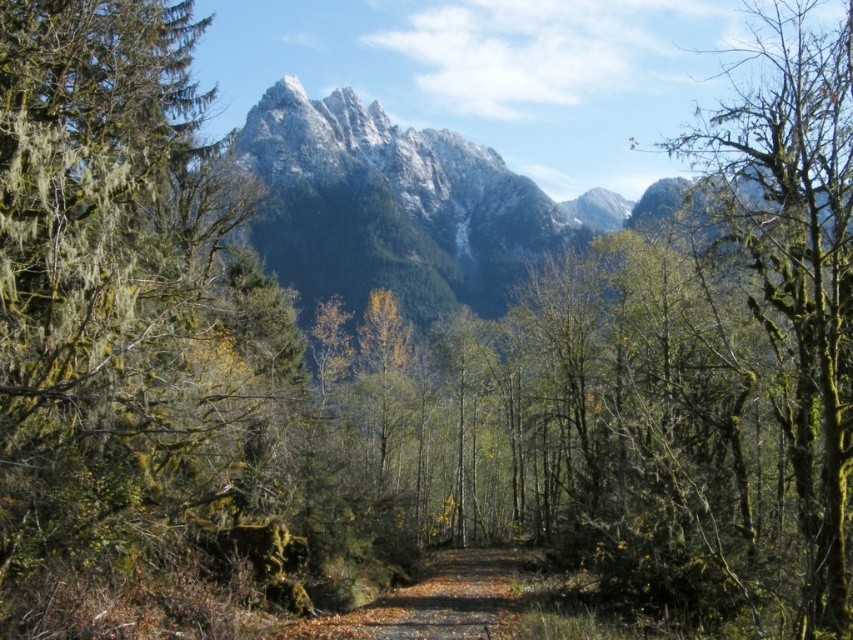
You are a hiker walking along the brown wooden path at center in the forest. You want to take a photo of the green mossy tree at left from the path. Can you see the entire tree without any obstructions?

The green mossy tree at left is in front of the brown wooden path at center, so it is blocking your view. You cannot see the entire tree without moving closer or further away from the path.